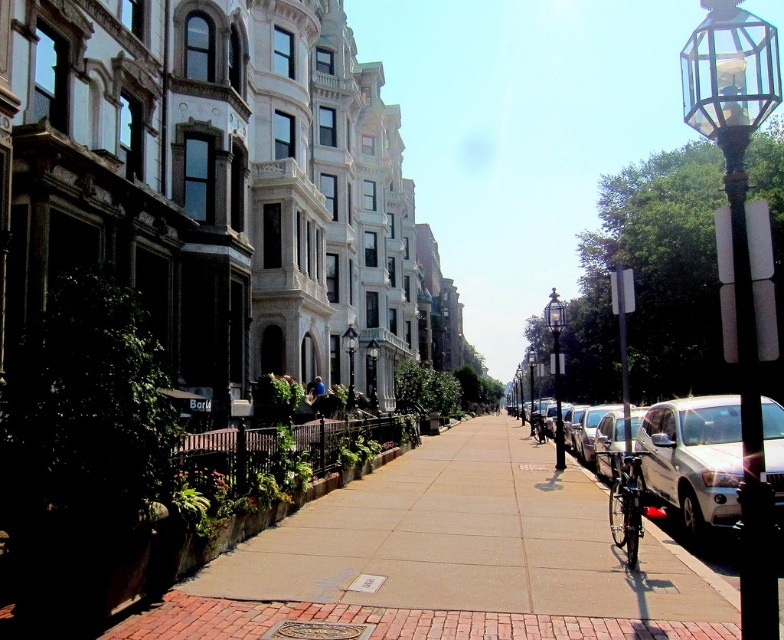
Question: Where is smooth concrete sidewalk at center located in relation to shiny black bicycle at center in the image?

Choices:
 (A) below
 (B) above

Answer: (B)

Question: Which object appears closest to the camera in this image?

Choices:
 (A) polished brass lamp post at center
 (B) polished brass streetlamp at center
 (C) black glass lamp post at right

Answer: (C)

Question: Which object is the closest to the shiny metallic bicycle at lower right?

Choices:
 (A) smooth concrete sidewalk at center
 (B) shiny black bicycle at center
 (C) white matte suv at right

Answer: (C)

Question: Is white matte car at center-right smaller than polished brass lamp post at center-right?

Choices:
 (A) no
 (B) yes

Answer: (B)

Question: Which point is farther to the camera?

Choices:
 (A) polished brass lamp post at center-right
 (B) black glass lamp post at right
 (C) smooth concrete sidewalk at center
 (D) polished brass streetlamp at center

Answer: (D)

Question: Is smooth concrete sidewalk at center thinner than shiny metallic bicycle at lower right?

Choices:
 (A) yes
 (B) no

Answer: (B)